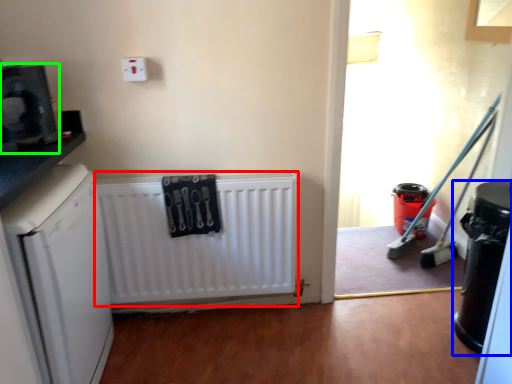
Question: Considering the real-world distances, which object is closest to radiator (highlighted by a red box)? appliance (highlighted by a blue box) or appliance (highlighted by a green box).

Choices:
 (A) appliance
 (B) appliance

Answer: (B)